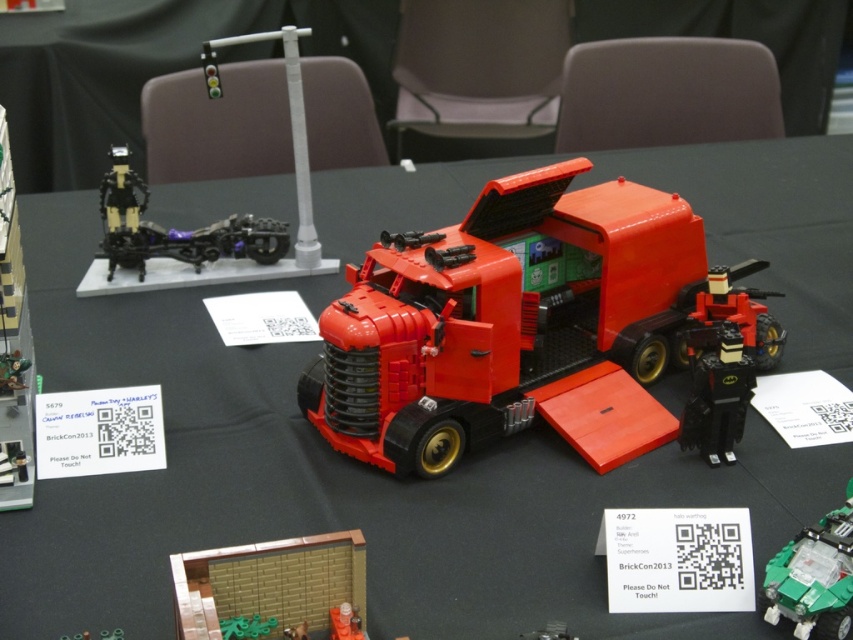
You are at a LEGO convention and see the brick wall at center and the transparent plastic car at center. Which object is wider?

The brick wall at center is wider than the transparent plastic car at center.

Looking at this image, you are a photographer at BrickCon2013 trying to capture the brick wall at center and the transparent plastic car at center in a single shot. Which object will appear larger in your photo?

The brick wall at center will appear larger in the photo because it is closer to the viewer than the transparent plastic car at center.

You are at a LEGO convention and want to place both the brick red plastic truck at center and the orange matte truck at center on a shelf. If the shelf can only hold items up to 18 inches in width, which truck should you choose to fit on the shelf?

The orange matte truck at center is narrower than the brick red plastic truck at center. Therefore, the orange matte truck at center would fit on the shelf since it is narrower and under 18 inches in width.